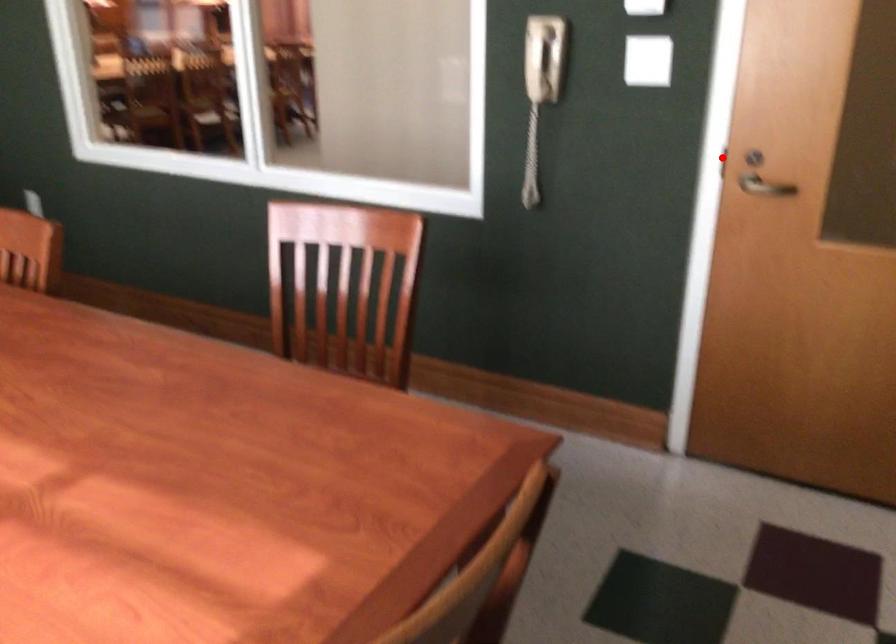
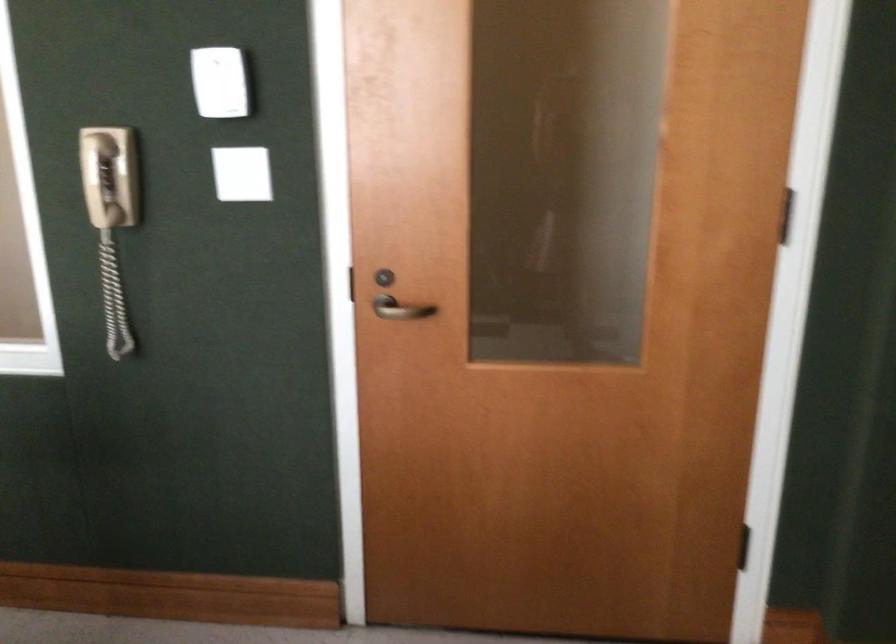
Question: I am providing you with two images of the same scene from different viewpoints. Given a red point in image1, look at the same physical point in image2. Is it:

Choices:
 (A) Closer to the viewpoint
 (B) Farther from the viewpoint

Answer: (A)